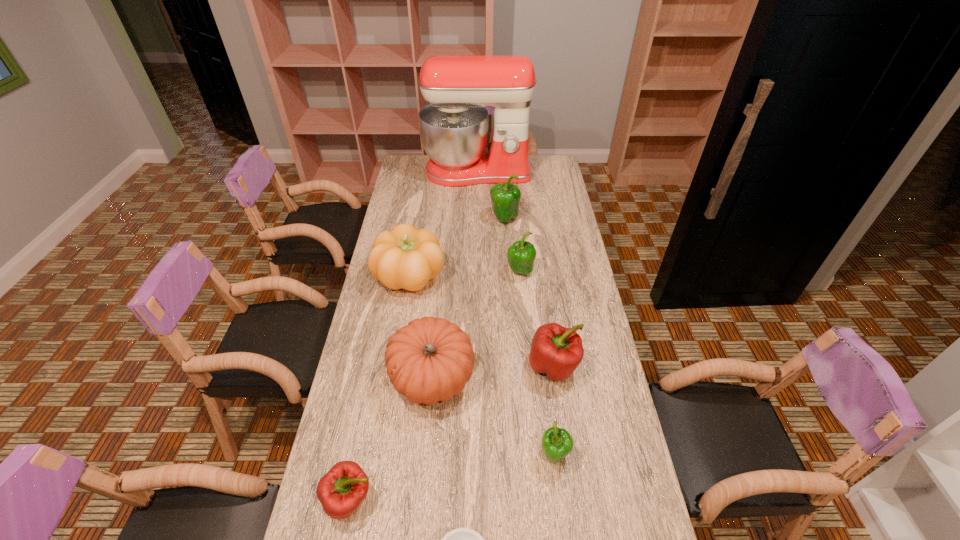
Where is `free space located on the back of the third farthest bell pepper`? free space located on the back of the third farthest bell pepper is located at coordinates (544, 307).

I want to click on vacant area located 0.150m on the left of the nearest green bell pepper, so [x=485, y=455].

This screenshot has height=540, width=960. Find the location of `vacant space located on the right of the second nearest object`. vacant space located on the right of the second nearest object is located at coordinates (529, 499).

At what (x,y) coordinates should I click in order to perform the action: click on object at the far edge. Please return your answer as a coordinate pair (x, y). Looking at the image, I should click on (454, 126).

At what (x,y) coordinates should I click in order to perform the action: click on mixer present at the left edge. Please return your answer as a coordinate pair (x, y). The width and height of the screenshot is (960, 540). Looking at the image, I should click on (454, 126).

I want to click on bell pepper at the left edge, so pos(343,488).

This screenshot has height=540, width=960. Find the location of `mixer that is positioned at the right edge`. mixer that is positioned at the right edge is located at coordinates (454, 126).

The height and width of the screenshot is (540, 960). Identify the location of bell pepper that is at the right edge. (557, 351).

You are a GUI agent. You are given a task and a screenshot of the screen. Output one action in this format:
    pyautogui.click(x=<x>, y=<y>)
    Task: Click on the object that is at the far left corner
    
    Given the screenshot: What is the action you would take?
    pyautogui.click(x=454, y=126)

Image resolution: width=960 pixels, height=540 pixels. In order to click on object situated at the far right corner in this screenshot , I will do `click(454, 126)`.